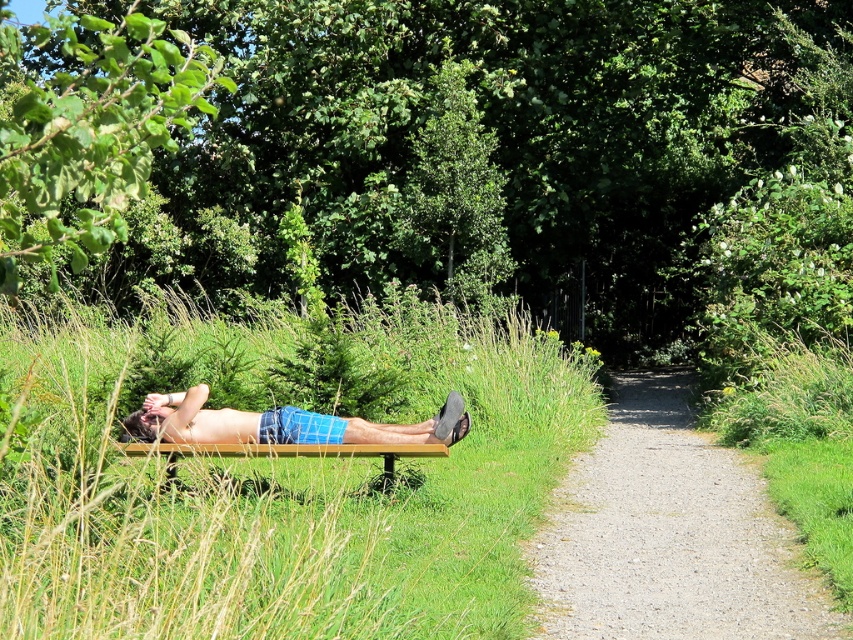
Does blue plaid shorts at center have a greater width compared to wooden bench at center?

Correct, the width of blue plaid shorts at center exceeds that of wooden bench at center.

Which is more to the left, blue plaid shorts at center or wooden bench at center?

wooden bench at center

Is point (187, 442) more distant than point (440, 451)?

That is True.

Image resolution: width=853 pixels, height=640 pixels. What are the coordinates of `blue plaid shorts at center` in the screenshot? It's located at (280, 422).

Is point (556, 150) more distant than point (486, 161)?

Yes, it is behind point (486, 161).

You are a GUI agent. You are given a task and a screenshot of the screen. Output one action in this format:
    pyautogui.click(x=<x>, y=<y>)
    Task: Click on the green leafy tree at upper center
    
    Given the screenshot: What is the action you would take?
    pyautogui.click(x=486, y=145)

Based on the photo, who is more forward, [688,182] or [410,230]?

Point [410,230] is in front.

Identify the location of green leafy tree at upper center. This screenshot has height=640, width=853. (486, 145).

Which of these two, green grass at center or blue plaid shorts at center, stands taller?

green grass at center

Does point (183, 333) lie behind point (434, 428)?

Yes.

Where is `green grass at center`? green grass at center is located at coordinates (277, 481).